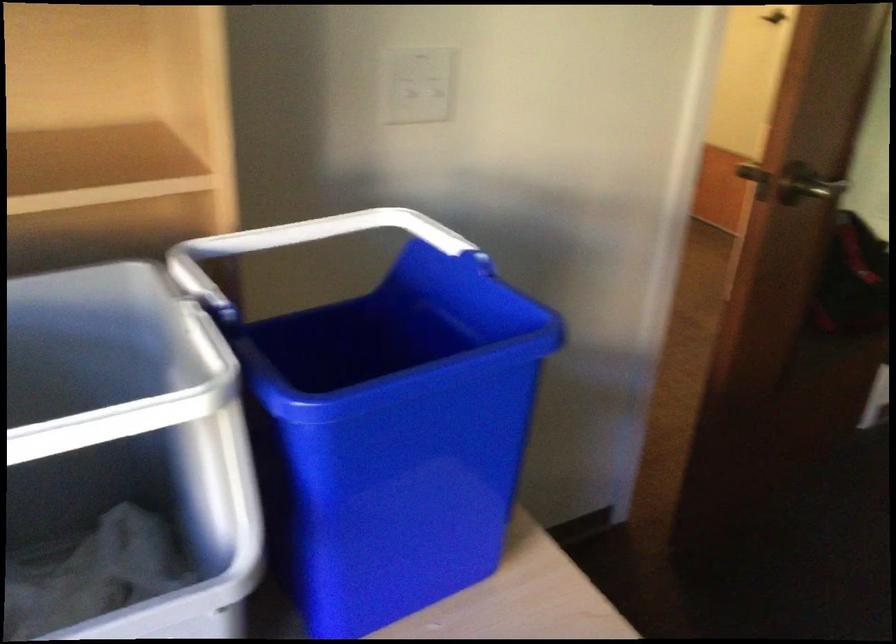
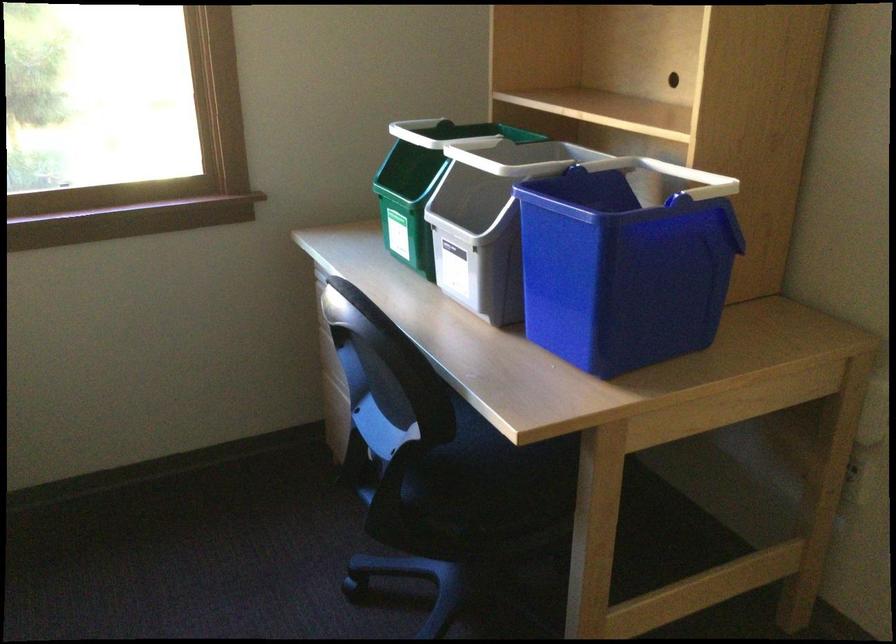
Question: I am providing you with two images of the same scene from different viewpoints. Please identify which objects are invisible in image2.

Choices:
 (A) chair sitting surface
 (B) grey shoe box
 (C) white bin handle
 (D) grey bin rim

Answer: (D)